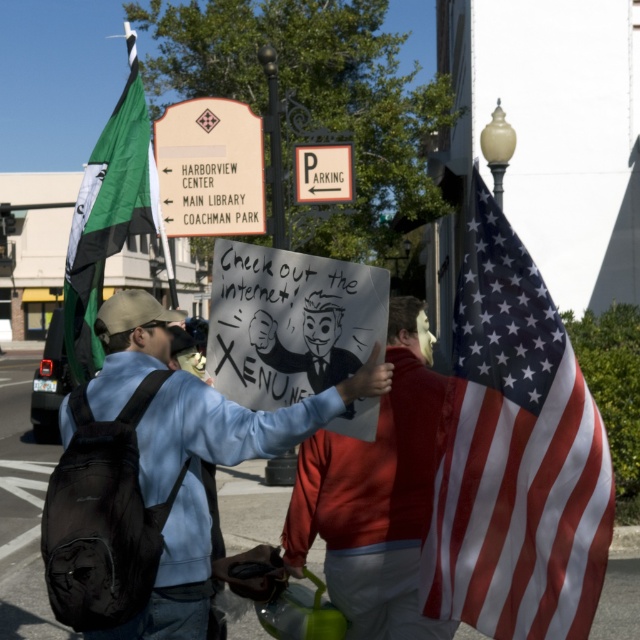
Is red cotton hoodie at center below matte blue sweatshirt at center?

Correct, red cotton hoodie at center is located below matte blue sweatshirt at center.

Between point (291, 506) and point (291, 413), which one is positioned in front?

Point (291, 413)

Locate an element on the screen. red cotton hoodie at center is located at coordinates (376, 493).

Does red cotton hoodie at center appear on the right side of green fabric flag at left?

Correct, you'll find red cotton hoodie at center to the right of green fabric flag at left.

Who is positioned more to the right, red cotton hoodie at center or green fabric flag at left?

red cotton hoodie at center is more to the right.

What do you see at coordinates (376, 493) in the screenshot?
I see `red cotton hoodie at center` at bounding box center [376, 493].

What are the coordinates of `red cotton hoodie at center` in the screenshot? It's located at (376, 493).

Is red cotton hoodie at center to the right of white paper sign at center from the viewer's perspective?

Correct, you'll find red cotton hoodie at center to the right of white paper sign at center.

Who is taller, red cotton hoodie at center or white paper sign at center?

red cotton hoodie at center is taller.

Between point (344, 545) and point (330, 301), which one is positioned behind?

Point (344, 545)

Image resolution: width=640 pixels, height=640 pixels. Identify the location of red cotton hoodie at center. coord(376,493).